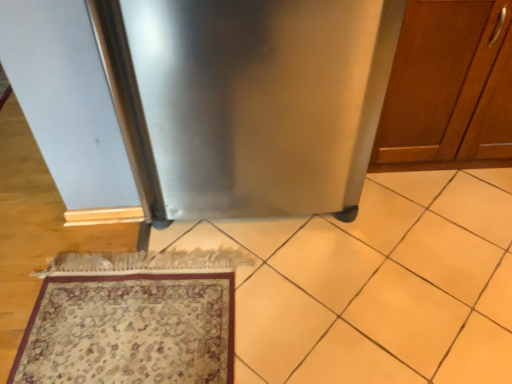
Question: Is wooden cabinet at right positioned beyond the bounds of stainless steel refrigerator at center?

Choices:
 (A) yes
 (B) no

Answer: (A)

Question: Can you confirm if wooden cabinet at right is smaller than stainless steel refrigerator at center?

Choices:
 (A) yes
 (B) no

Answer: (A)

Question: Can you confirm if wooden cabinet at right is thinner than stainless steel refrigerator at center?

Choices:
 (A) yes
 (B) no

Answer: (A)

Question: Is the surface of wooden cabinet at right in direct contact with stainless steel refrigerator at center?

Choices:
 (A) yes
 (B) no

Answer: (B)

Question: Is wooden cabinet at right at the left side of stainless steel refrigerator at center?

Choices:
 (A) yes
 (B) no

Answer: (B)

Question: Considering the relative positions of wooden cabinet at right and stainless steel refrigerator at center in the image provided, is wooden cabinet at right to the left or to the right of stainless steel refrigerator at center?

Choices:
 (A) left
 (B) right

Answer: (B)

Question: Is point (389, 125) positioned closer to the camera than point (150, 110)?

Choices:
 (A) farther
 (B) closer

Answer: (A)

Question: Is wooden cabinet at right situated inside stainless steel refrigerator at center or outside?

Choices:
 (A) outside
 (B) inside

Answer: (A)

Question: From the image's perspective, is wooden cabinet at right located above or below stainless steel refrigerator at center?

Choices:
 (A) below
 (B) above

Answer: (B)

Question: Looking at their shapes, would you say carpeted rug at lower left is wider or thinner than stainless steel refrigerator at center?

Choices:
 (A) thin
 (B) wide

Answer: (A)

Question: Considering the relative positions of carpeted rug at lower left and stainless steel refrigerator at center in the image provided, is carpeted rug at lower left to the left or to the right of stainless steel refrigerator at center?

Choices:
 (A) right
 (B) left

Answer: (B)

Question: From the image's perspective, is carpeted rug at lower left positioned above or below stainless steel refrigerator at center?

Choices:
 (A) below
 (B) above

Answer: (A)

Question: Is point (214, 299) closer or farther from the camera than point (336, 49)?

Choices:
 (A) closer
 (B) farther

Answer: (B)

Question: From the image's perspective, is stainless steel refrigerator at center positioned above or below wooden cabinet at right?

Choices:
 (A) below
 (B) above

Answer: (A)

Question: In terms of size, does stainless steel refrigerator at center appear bigger or smaller than wooden cabinet at right?

Choices:
 (A) big
 (B) small

Answer: (A)